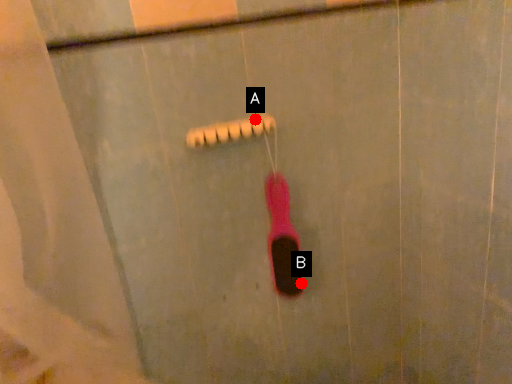
Question: Two points are circled on the image, labeled by A and B beside each circle. Among these points, which one is nearest to the camera?

Choices:
 (A) A is closer
 (B) B is closer

Answer: (A)